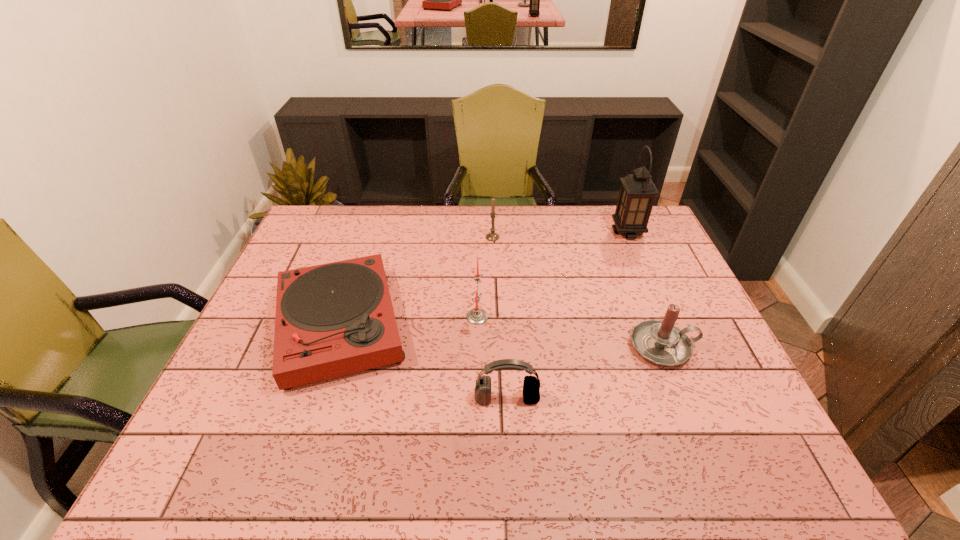
I want to click on vacant region at the near left corner of the desktop, so click(236, 462).

Identify the location of vacant region between the rightmost candle and the shortest object. The height and width of the screenshot is (540, 960). (501, 336).

Locate an element on the screen. This screenshot has height=540, width=960. free space between the tallest object and the record player is located at coordinates (484, 279).

I want to click on free space between the lantern and the headset, so click(x=567, y=315).

Where is `free area in between the farthest candle and the tallest object`? free area in between the farthest candle and the tallest object is located at coordinates (560, 235).

The width and height of the screenshot is (960, 540). I want to click on blank region between the shortest object and the headset, so click(x=423, y=362).

Where is `object that is the closest to the record player`? object that is the closest to the record player is located at coordinates (476, 316).

Choose which object is the fifth nearest neighbor to the shortest object. Please provide its 2D coordinates. Your answer should be formatted as a tuple, i.e. [(x, y)], where the tuple contains the x and y coordinates of a point satisfying the conditions above.

[(637, 193)]

Locate an element on the screen. This screenshot has width=960, height=540. the third closest candle to the shortest object is located at coordinates (660, 342).

Identify which candle is located as the third nearest to the tallest object. Please provide its 2D coordinates. Your answer should be formatted as a tuple, i.e. [(x, y)], where the tuple contains the x and y coordinates of a point satisfying the conditions above.

[(476, 316)]